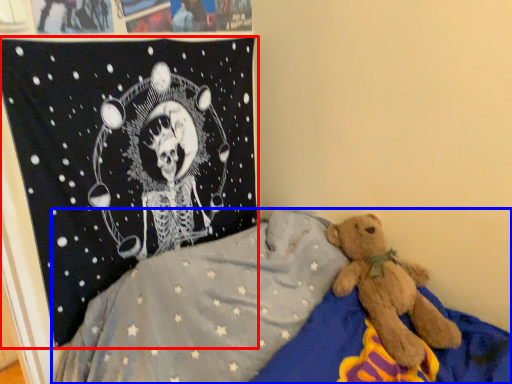
Question: Among these objects, which one is nearest to the camera, pirate flag (highlighted by a red box) or bed (highlighted by a blue box)?

Choices:
 (A) pirate flag
 (B) bed

Answer: (B)